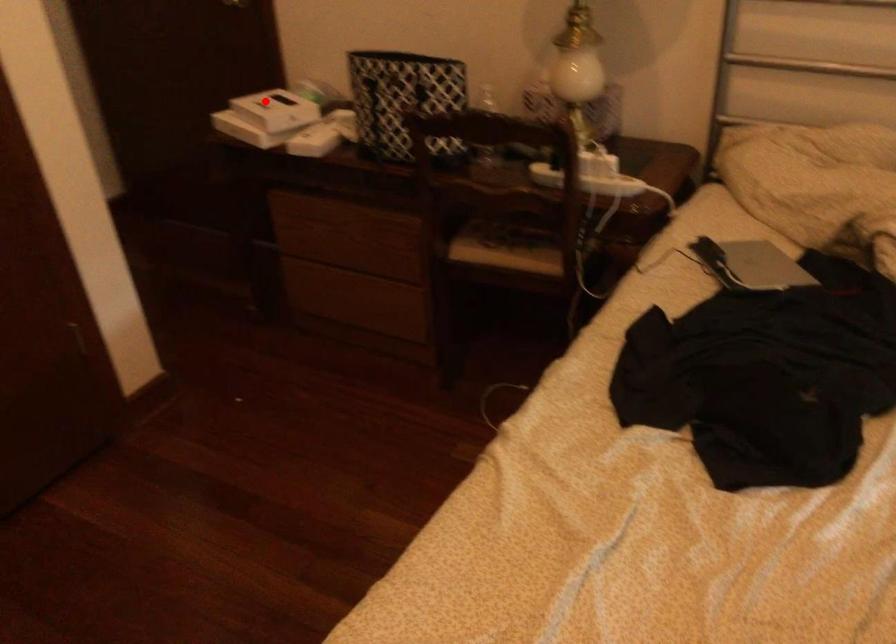
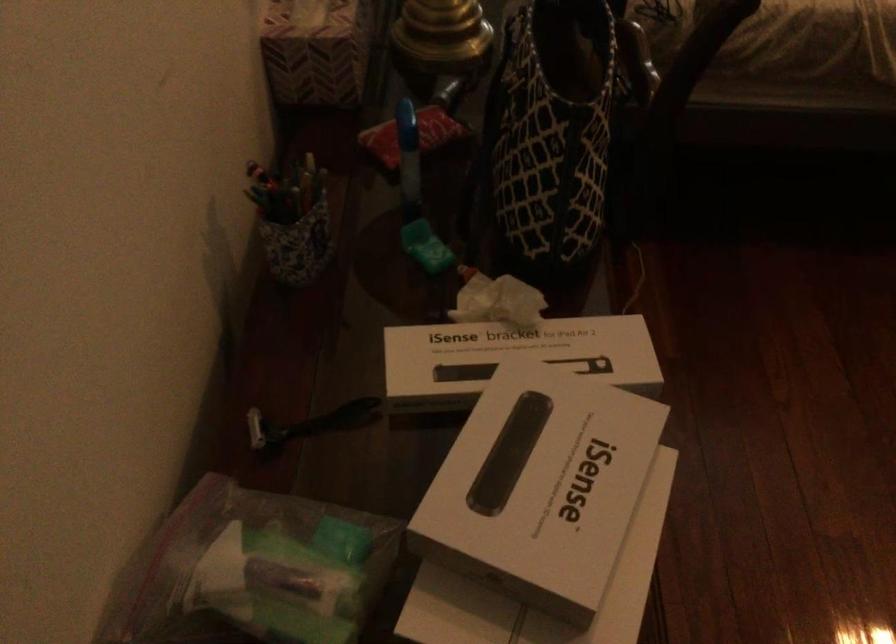
Question: A red point is marked in image1. In image2, is the corresponding 3D point closer to the camera or farther? Reply with the corresponding letter.

Choices:
 (A) The corresponding 3D point is closer.
 (B) The corresponding 3D point is farther.

Answer: (A)